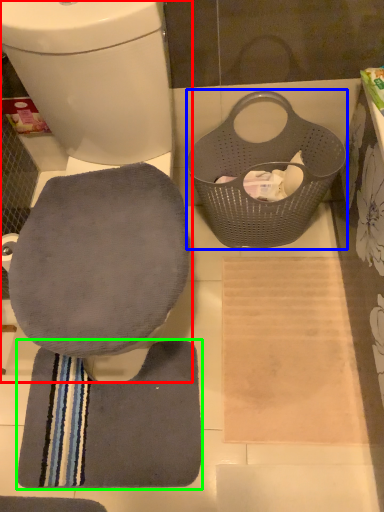
Question: Which object is positioned farthest from toilet (highlighted by a red box)? Select from laundry basket (highlighted by a blue box) and bath towel (highlighted by a green box).

Choices:
 (A) laundry basket
 (B) bath towel

Answer: (B)